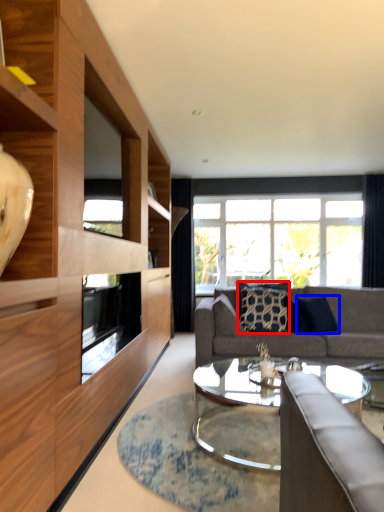
Question: Which point is closer to the camera, pillow (highlighted by a red box) or pillow (highlighted by a blue box)?

Choices:
 (A) pillow
 (B) pillow

Answer: (B)